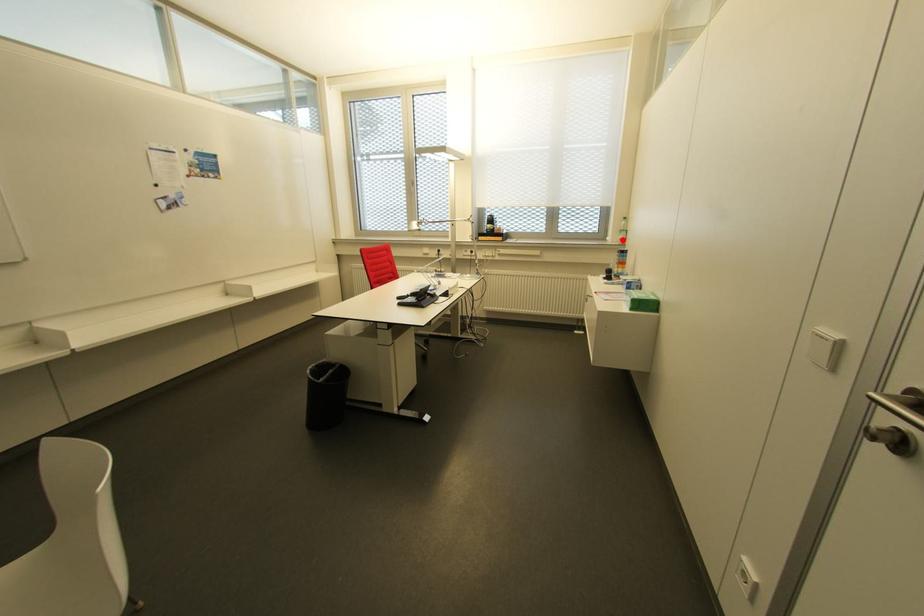
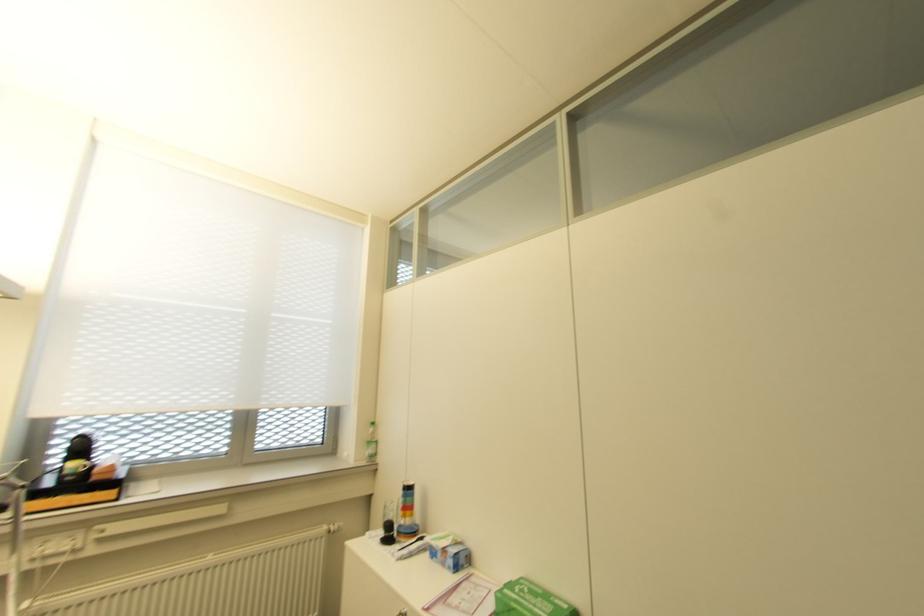
Where in the second image is the point corresponding to the highlighted location from the first image?

(372, 455)